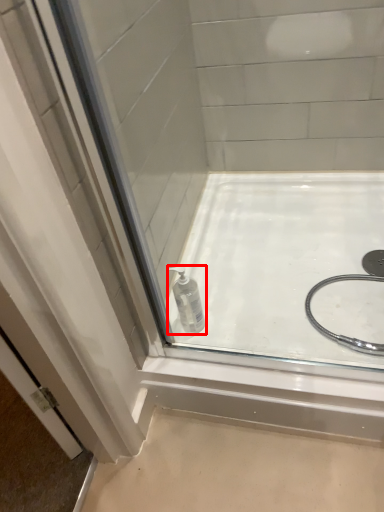
Question: From the image's perspective, what is the correct spatial positioning of bottle (annotated by the red box) in reference to bath?

Choices:
 (A) below
 (B) above

Answer: (A)